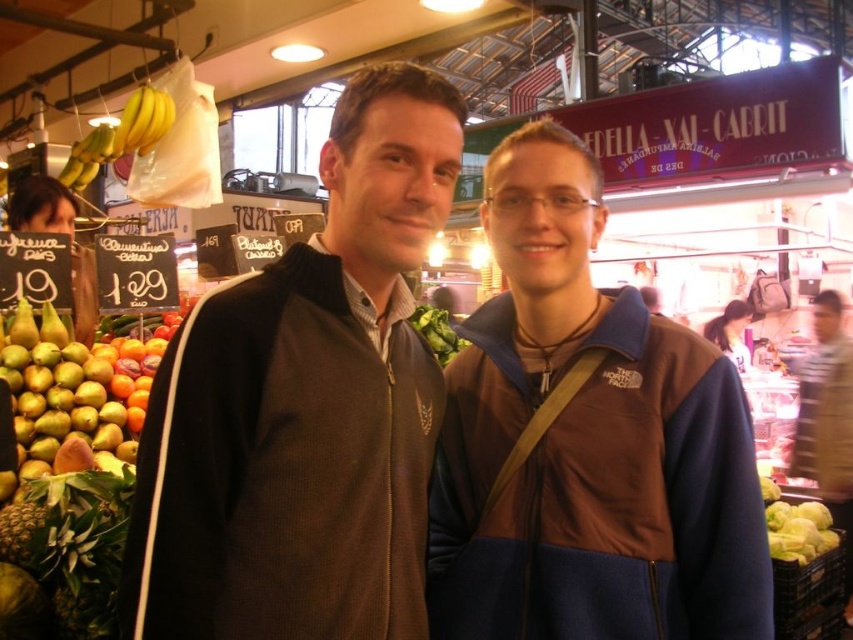
Question: Which point is farther from the camera taking this photo?

Choices:
 (A) (100, 637)
 (B) (772, 518)
 (C) (386, 442)
 (D) (699, 465)

Answer: (B)

Question: Can you confirm if brown textured jacket at center is thinner than green leafy at left?

Choices:
 (A) no
 (B) yes

Answer: (A)

Question: Is brown fleece jacket at center in front of green leafy vegetable at lower right?

Choices:
 (A) no
 (B) yes

Answer: (B)

Question: Can you confirm if brown textured jacket at center is positioned to the left of green leafy vegetable at lower right?

Choices:
 (A) yes
 (B) no

Answer: (A)

Question: Which of these objects is positioned farthest from the green leafy at center?

Choices:
 (A) brown textured jacket at center
 (B) brown fleece jacket at center
 (C) green leafy vegetable at lower right

Answer: (C)

Question: Which point appears farthest from the camera in this image?

Choices:
 (A) (445, 326)
 (B) (67, 570)
 (C) (608, 556)

Answer: (A)